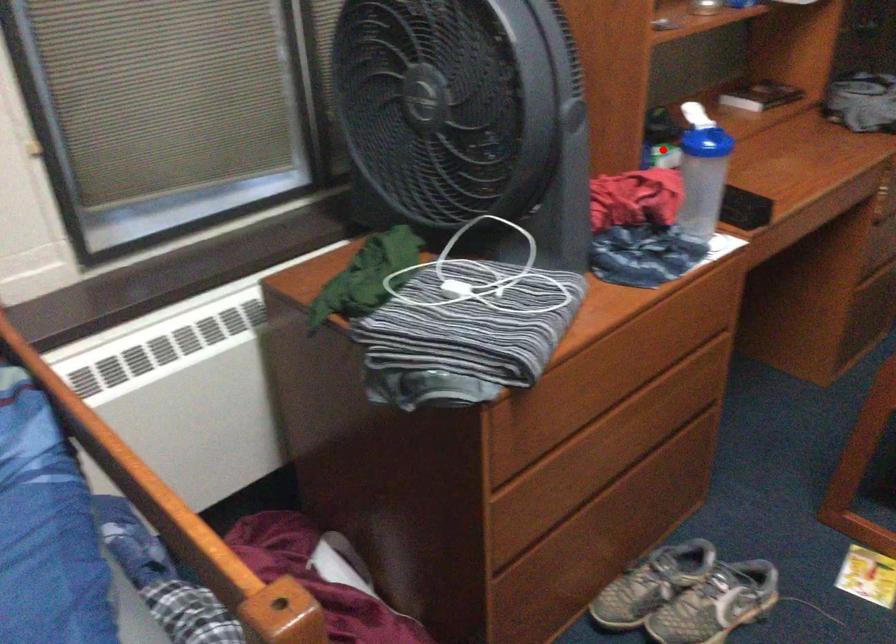
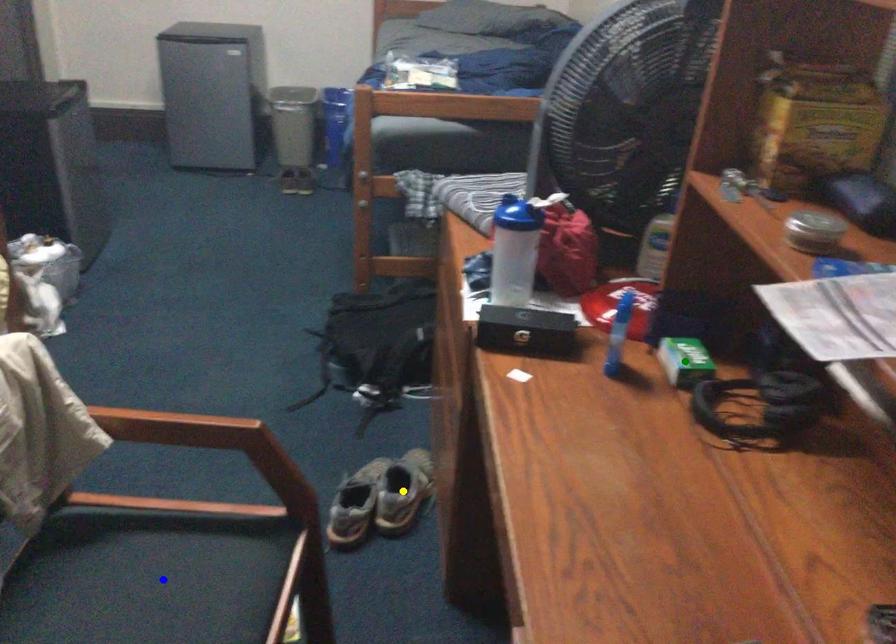
Question: I am providing you with two images of the same scene from different viewpoints. A red point is marked on the first image. You are given multiple points on the second image. Which mark in image 2 goes with the point in image 1?

Choices:
 (A) yellow point
 (B) green point
 (C) blue point

Answer: (B)